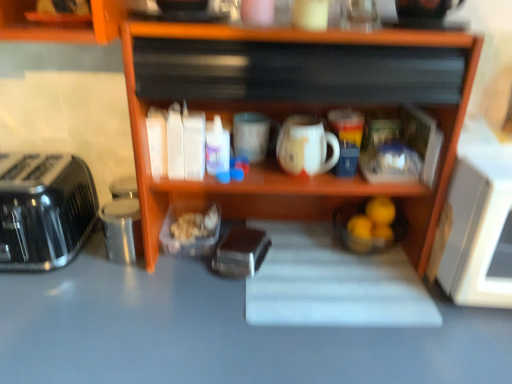
Question: Considering the relative sizes of white glossy mug at center and metallic silver toaster at center in the image provided, is white glossy mug at center taller than metallic silver toaster at center?

Choices:
 (A) yes
 (B) no

Answer: (A)

Question: Does white glossy mug at center have a lesser width compared to metallic silver toaster at center?

Choices:
 (A) no
 (B) yes

Answer: (B)

Question: Is white glossy mug at center positioned before metallic silver toaster at center?

Choices:
 (A) no
 (B) yes

Answer: (B)

Question: From the image's perspective, is white glossy mug at center on top of metallic silver toaster at center?

Choices:
 (A) yes
 (B) no

Answer: (A)

Question: Is white glossy mug at center to the left of metallic silver toaster at center from the viewer's perspective?

Choices:
 (A) no
 (B) yes

Answer: (A)

Question: In terms of width, does white glossy mug at center look wider or thinner when compared to smooth gray countertop at center?

Choices:
 (A) wide
 (B) thin

Answer: (B)

Question: From the image's perspective, relative to smooth gray countertop at center, is white glossy mug at center above or below?

Choices:
 (A) below
 (B) above

Answer: (B)

Question: In terms of height, does white glossy mug at center look taller or shorter compared to smooth gray countertop at center?

Choices:
 (A) short
 (B) tall

Answer: (A)

Question: Is white glossy mug at center inside or outside of smooth gray countertop at center?

Choices:
 (A) inside
 (B) outside

Answer: (B)

Question: Is wooden shelf at center inside the boundaries of smooth gray countertop at center, or outside?

Choices:
 (A) inside
 (B) outside

Answer: (B)

Question: Relative to smooth gray countertop at center, is wooden shelf at center in front or behind?

Choices:
 (A) front
 (B) behind

Answer: (B)

Question: In terms of height, does wooden shelf at center look taller or shorter compared to smooth gray countertop at center?

Choices:
 (A) tall
 (B) short

Answer: (B)

Question: Considering the positions of point (433, 200) and point (458, 357), is point (433, 200) closer or farther from the camera than point (458, 357)?

Choices:
 (A) closer
 (B) farther

Answer: (B)

Question: Is point (69, 210) positioned closer to the camera than point (57, 370)?

Choices:
 (A) farther
 (B) closer

Answer: (A)

Question: Relative to smooth gray countertop at center, is satin black toaster at left in front or behind?

Choices:
 (A) front
 (B) behind

Answer: (B)